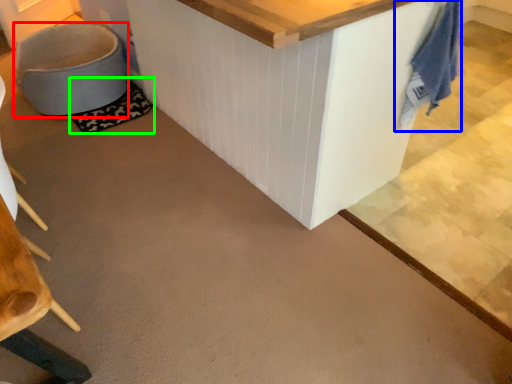
Question: Based on their relative distances, which object is farther from swivel chair (highlighted by a red box)? Choose from laundry (highlighted by a blue box) and mat (highlighted by a green box).

Choices:
 (A) laundry
 (B) mat

Answer: (A)